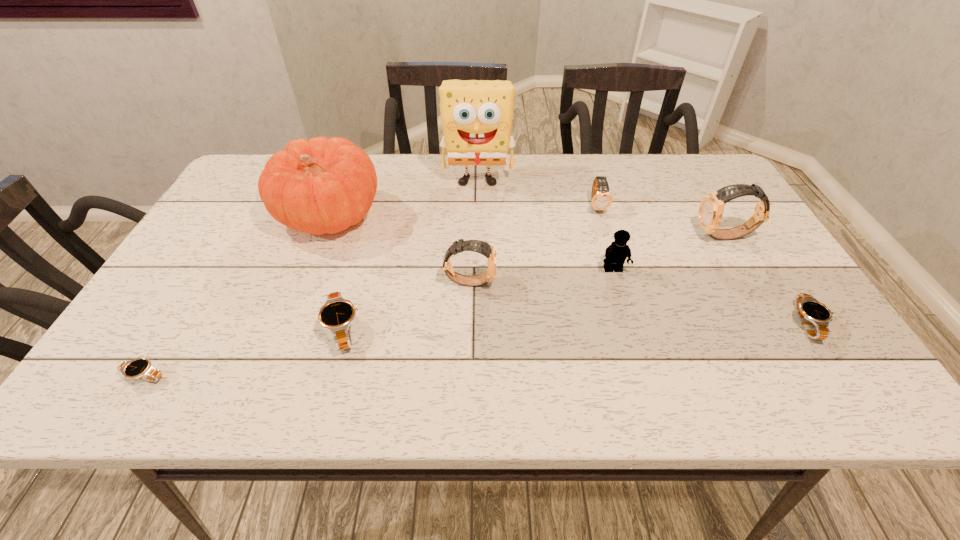
The height and width of the screenshot is (540, 960). I want to click on sponge, so click(x=476, y=115).

Identify the location of yellow sponge. The width and height of the screenshot is (960, 540). (476, 115).

Identify the location of pumpkin. (323, 185).

Find the location of a particular element. The width and height of the screenshot is (960, 540). the second tallest object is located at coordinates (323, 185).

You are a GUI agent. You are given a task and a screenshot of the screen. Output one action in this format:
    pyautogui.click(x=<x>, y=<y>)
    Task: Click on the tallest watch
    Image resolution: width=960 pixels, height=540 pixels.
    Given the screenshot: What is the action you would take?
    pyautogui.click(x=710, y=212)

At what (x,y) coordinates should I click in order to perform the action: click on the biggest gold watch. Please return your answer as a coordinate pair (x, y). Looking at the image, I should click on (710, 212).

Find the location of `the fourth nearest watch`. the fourth nearest watch is located at coordinates (484, 248).

The height and width of the screenshot is (540, 960). I want to click on the fifth shortest watch, so click(x=484, y=248).

At what (x,y) coordinates should I click in order to perform the action: click on Lego. Please return your answer as a coordinate pair (x, y). This screenshot has width=960, height=540. Looking at the image, I should click on (616, 253).

What are the coordinates of `the fourth shortest watch` in the screenshot? It's located at (601, 199).